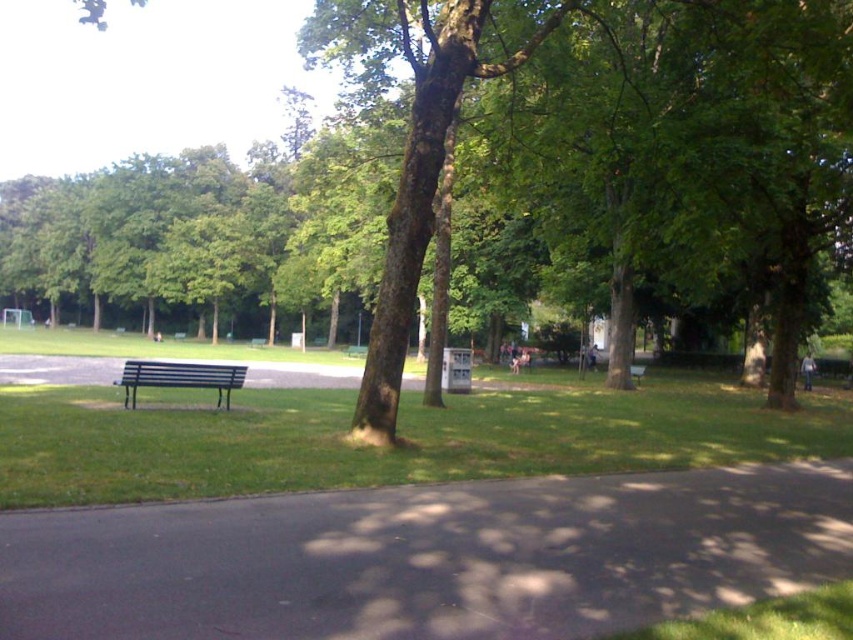
Question: Is metallic blue bench at center-left wider than metallic silver bench at center?

Choices:
 (A) no
 (B) yes

Answer: (B)

Question: Which point appears farthest from the camera in this image?

Choices:
 (A) (730, 106)
 (B) (631, 371)

Answer: (B)

Question: Considering the relative positions of brown textured tree at center and metallic blue bench at center-left in the image provided, where is brown textured tree at center located with respect to metallic blue bench at center-left?

Choices:
 (A) below
 (B) above

Answer: (B)

Question: Which is nearer to the metallic silver bench at center?

Choices:
 (A) brown textured tree at center
 (B) metallic blue bench at center-left

Answer: (A)

Question: Can you confirm if metallic blue bench at center-left is positioned to the right of wooden park bench at center?

Choices:
 (A) yes
 (B) no

Answer: (B)

Question: Which point is farther to the camera?

Choices:
 (A) metallic silver bench at center
 (B) wooden park bench at center
 (C) brown textured tree at center

Answer: (A)